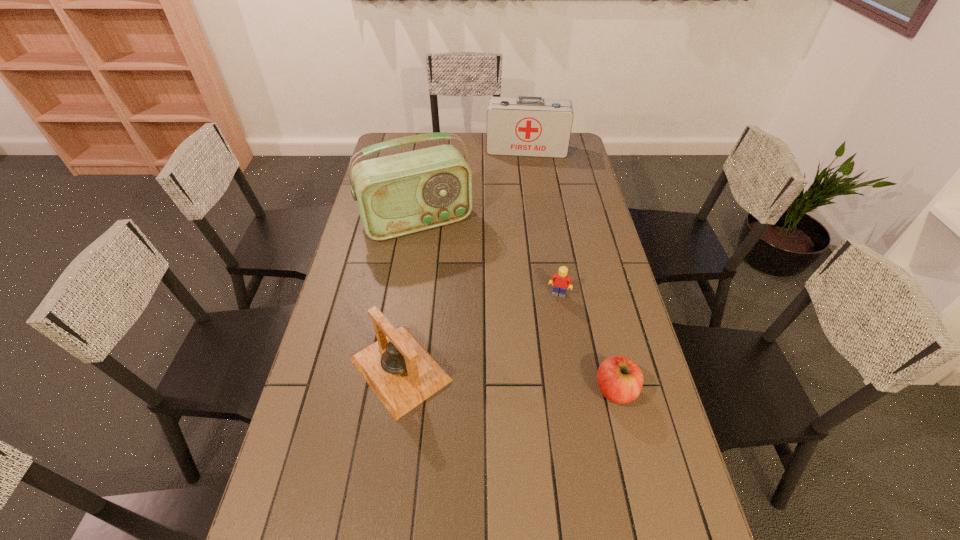
This screenshot has width=960, height=540. Identify the location of radio receiver located in the left edge section of the desktop. (400, 194).

The width and height of the screenshot is (960, 540). I want to click on apple located at the right edge, so click(620, 380).

Find the location of a particular element. the first-aid kit situated at the right edge is located at coordinates (526, 126).

Image resolution: width=960 pixels, height=540 pixels. What are the coordinates of `object situated at the far right corner` in the screenshot? It's located at (526, 126).

Where is `vacant space at the near edge of the desktop`? The image size is (960, 540). vacant space at the near edge of the desktop is located at coordinates (584, 511).

The width and height of the screenshot is (960, 540). I want to click on vacant space at the left edge, so click(353, 261).

Identify the location of vacant space at the right edge. The width and height of the screenshot is (960, 540). (555, 195).

The height and width of the screenshot is (540, 960). In the image, there is a desktop. In order to click on free space at the near right corner in this screenshot , I will do `click(626, 501)`.

The height and width of the screenshot is (540, 960). In order to click on blank region between the tallest object and the Lego in this screenshot , I will do `click(488, 258)`.

Locate an element on the screen. This screenshot has width=960, height=540. empty location between the third tallest object and the first-aid kit is located at coordinates (464, 260).